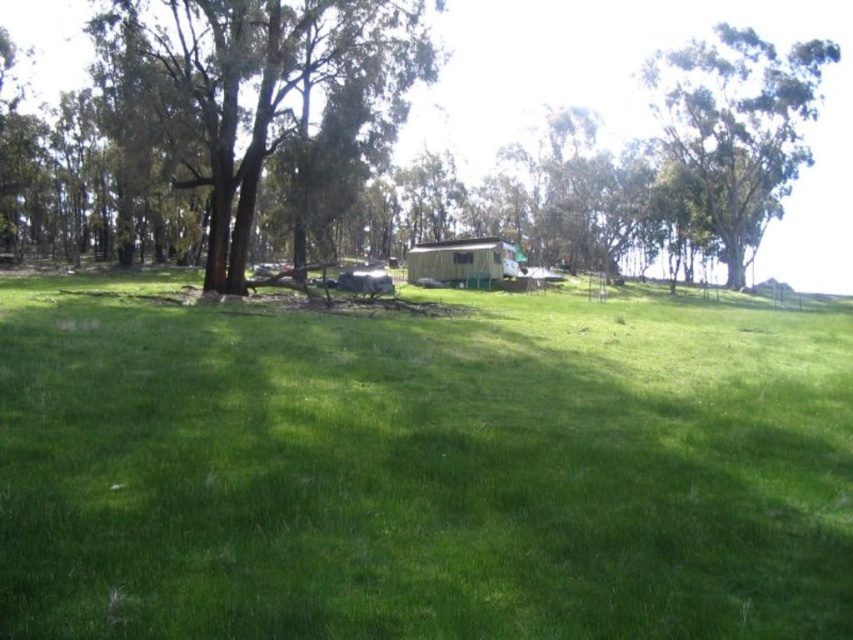
You are planning to set up a picnic spot in the grassy area. Considering the green leafy tree at upper right and the white plastic hut at center, which object would provide more shade for your picnic blanket?

The green leafy tree at upper right is much taller than the white plastic hut at center, so it would cast a larger shadow and provide more shade for the picnic blanket.

You are standing at the edge of the green grassy field at center and want to walk towards the green leafy tree at upper right. Which direction should you head?

You should head towards the upper right direction since the green grassy field at center is positioned under the green leafy tree at upper right, indicating the tree is located above and to the right of the field from your current position.

Based on the photo, you are standing in the middle of the green grassy field at center and looking towards the brown rough tree at center. Which object is closer to you?

The green grassy field at center is in front of the brown rough tree at center, so the green grassy field at center is closer to you.